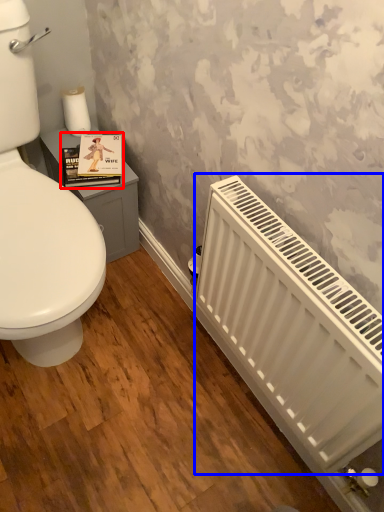
Question: Which of the following is the farthest to the observer, book cover (highlighted by a red box) or radiator (highlighted by a blue box)?

Choices:
 (A) book cover
 (B) radiator

Answer: (A)